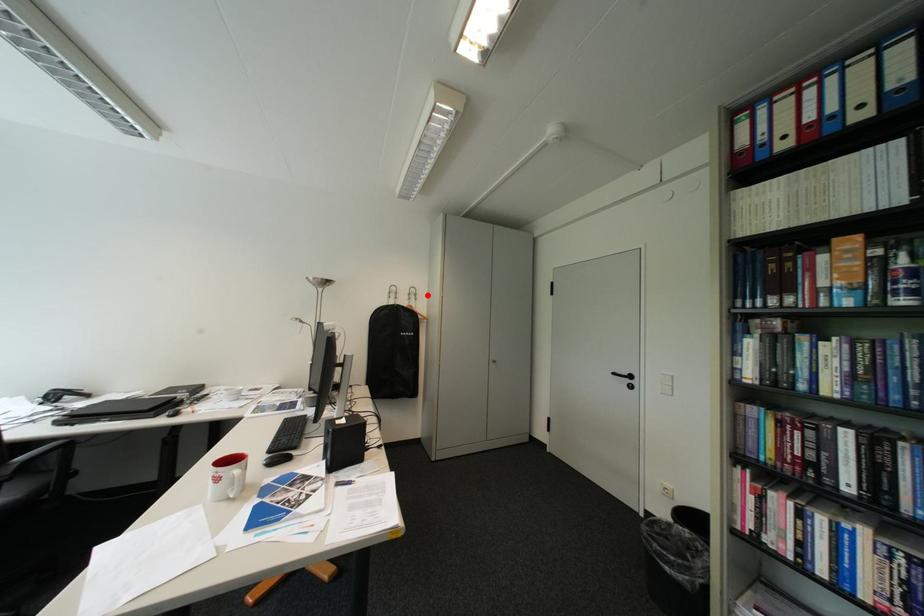
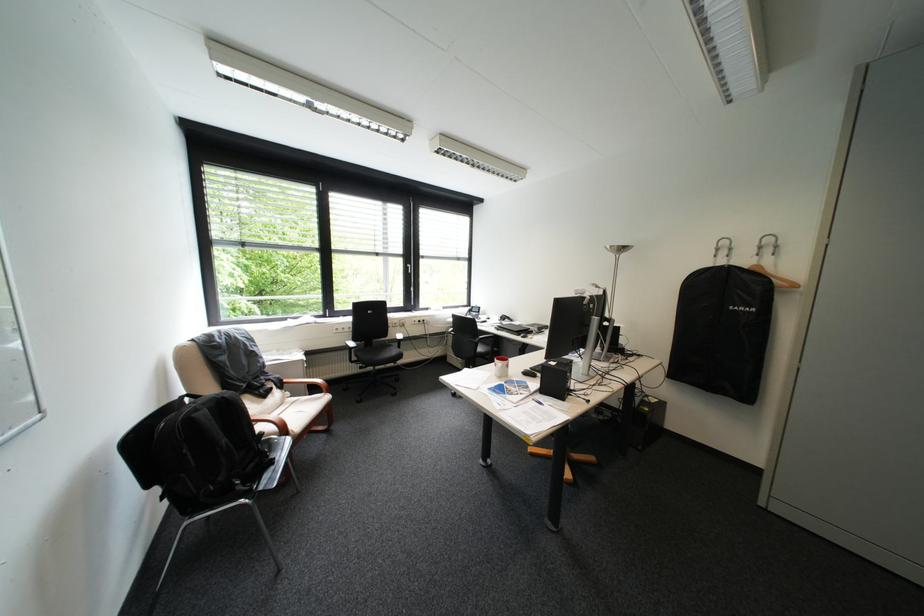
Locate, in the second image, the point that corresponds to the highlighted location in the first image.

(788, 246)